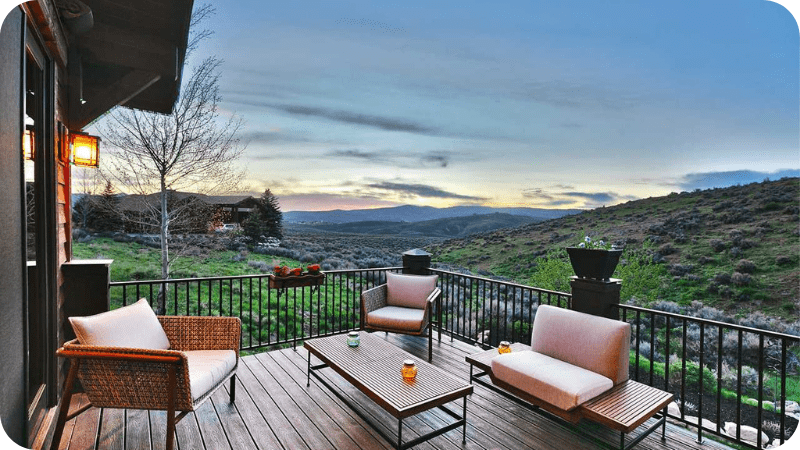
Image resolution: width=800 pixels, height=450 pixels. I want to click on flooring, so click(282, 418).